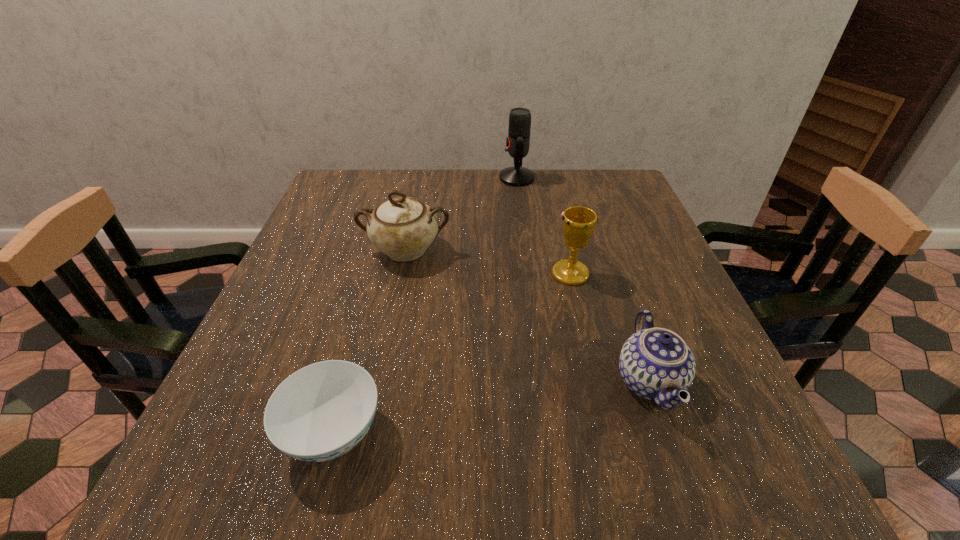
The width and height of the screenshot is (960, 540). I want to click on vacant space that satisfies the following two spatial constraints: 1. on the back side of the chalice; 2. on the side of the farthest object with the red ring, so click(547, 178).